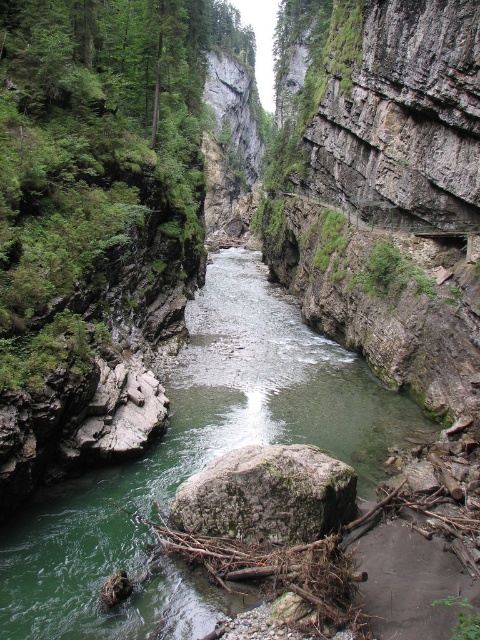
Question: Among these points, which one is farthest from the camera?

Choices:
 (A) (237, 456)
 (B) (168, 426)

Answer: (B)

Question: In this image, where is green rock at center located relative to green mossy rock at center?

Choices:
 (A) below
 (B) above

Answer: (B)

Question: Can you confirm if green rock at center is bigger than green mossy rock at center?

Choices:
 (A) no
 (B) yes

Answer: (B)

Question: In this image, where is green rock at center located relative to green mossy rock at center?

Choices:
 (A) below
 (B) above

Answer: (B)